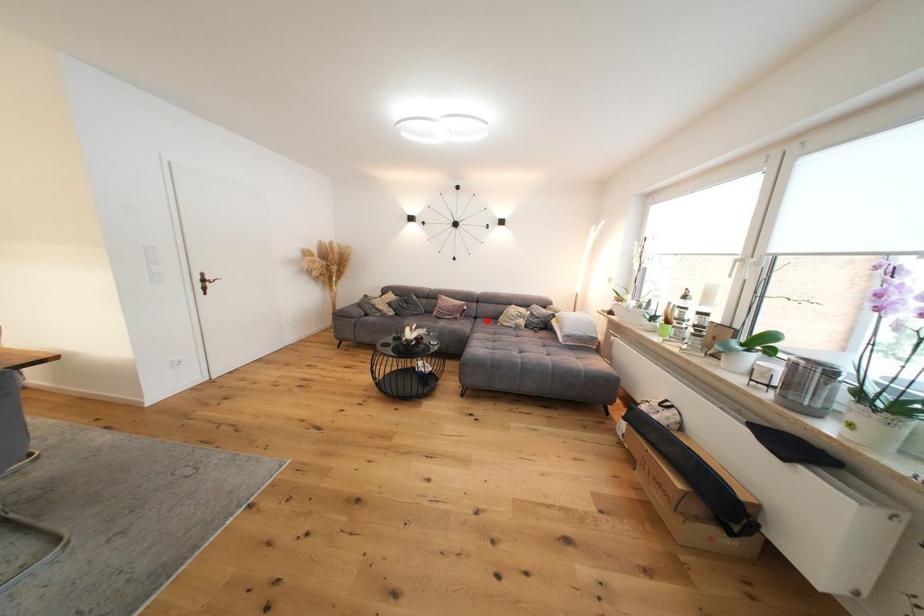
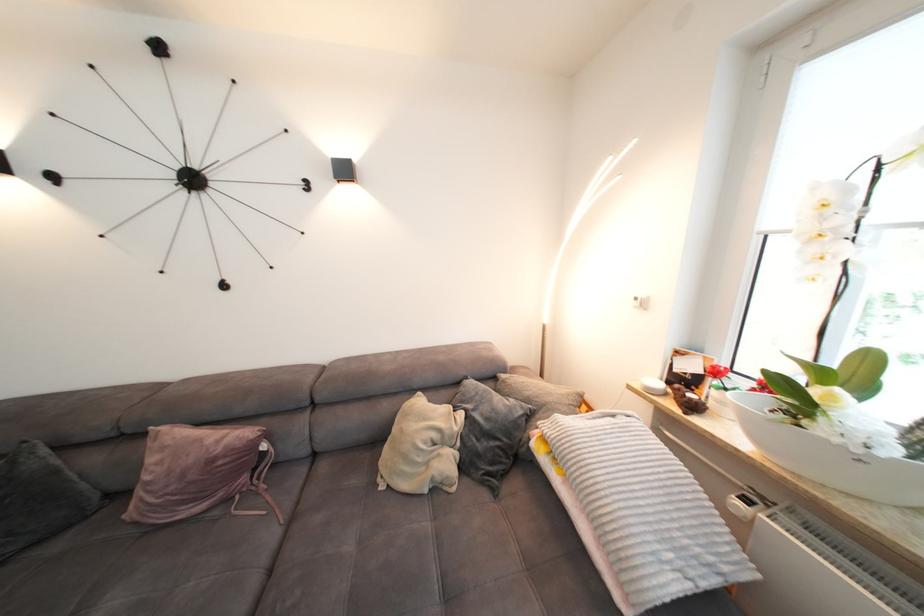
Question: I am providing you with two images of the same scene from different viewpoints. Image1 has a red point marked. In image2, the corresponding 3D location appears at what relative position? Reply with the corresponding letter.

Choices:
 (A) Closer
 (B) Farther

Answer: (B)